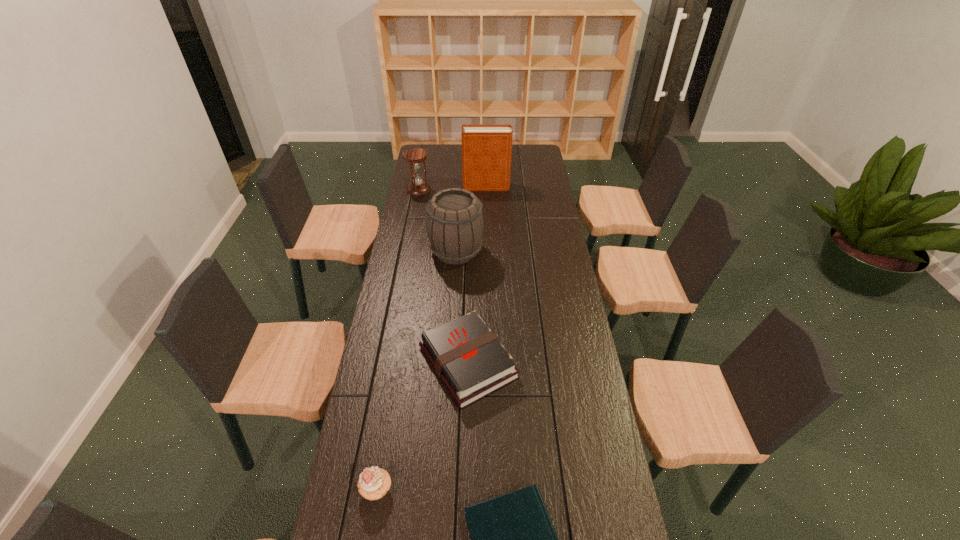
Locate an element on the screen. Image resolution: width=960 pixels, height=540 pixels. book that is the closest to the third farthest object is located at coordinates (467, 356).